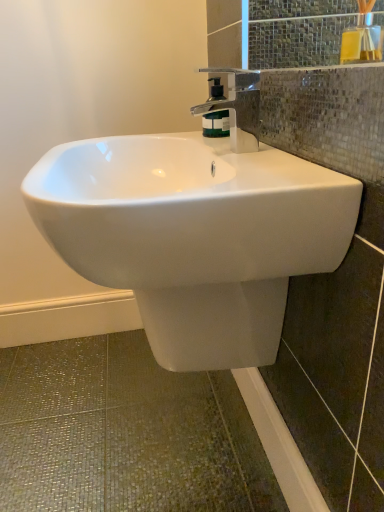
This screenshot has height=512, width=384. I want to click on polished chrome faucet at upper center, so [x=238, y=106].

The width and height of the screenshot is (384, 512). Describe the element at coordinates (216, 124) in the screenshot. I see `green matte soap dispenser at center` at that location.

The width and height of the screenshot is (384, 512). Identify the location of green matte soap dispenser at center. (216, 124).

The image size is (384, 512). Identify the location of white glossy sink at center. (194, 236).

Describe the element at coordinates (362, 39) in the screenshot. Image resolution: width=384 pixels, height=512 pixels. I see `yellow glass bottle at upper right` at that location.

Image resolution: width=384 pixels, height=512 pixels. Identify the location of polished chrome faucet at upper center. (238, 106).

Which of these two, white glossy sink at center or polished chrome faucet at upper center, is bigger?

With larger size is white glossy sink at center.

Is white glossy sink at center inside or outside of polished chrome faucet at upper center?

white glossy sink at center is located beyond the bounds of polished chrome faucet at upper center.

The width and height of the screenshot is (384, 512). What are the coordinates of `tap that appears behind the white glossy sink at center` in the screenshot? It's located at (238, 106).

Which of these two, white glossy sink at center or polished chrome faucet at upper center, is wider?

Wider between the two is white glossy sink at center.

Which object is more forward, green matte soap dispenser at center or polished chrome faucet at upper center?

polished chrome faucet at upper center is more forward.

From the image's perspective, which is above, green matte soap dispenser at center or polished chrome faucet at upper center?

green matte soap dispenser at center.

From their relative heights in the image, would you say green matte soap dispenser at center is taller or shorter than polished chrome faucet at upper center?

In the image, green matte soap dispenser at center appears to be shorter than polished chrome faucet at upper center.

Find the location of a particular element. soap dispenser behind the polished chrome faucet at upper center is located at coordinates (216, 124).

Considering the positions of point (301, 182) and point (351, 59), is point (301, 182) closer or farther from the camera than point (351, 59)?

Point (301, 182).

The width and height of the screenshot is (384, 512). Find the location of `mouthwash above the white glossy sink at center (from a real-world perspective)`. mouthwash above the white glossy sink at center (from a real-world perspective) is located at coordinates (362, 39).

Consider the image. From a real-world perspective, is white glossy sink at center physically located above or below yellow glass bottle at upper right?

white glossy sink at center is situated lower than yellow glass bottle at upper right in the real world.

Which of these two, white glossy sink at center or yellow glass bottle at upper right, is bigger?

white glossy sink at center.

You are a GUI agent. You are given a task and a screenshot of the screen. Output one action in this format:
    pyautogui.click(x=<x>, y=<y>)
    Task: Click on the soap dispenser behind the white glossy sink at center
    The width and height of the screenshot is (384, 512).
    Given the screenshot: What is the action you would take?
    pyautogui.click(x=216, y=124)

Can you confirm if green matte soap dispenser at center is bigger than white glossy sink at center?

Incorrect, green matte soap dispenser at center is not larger than white glossy sink at center.

From the image's perspective, who appears lower, green matte soap dispenser at center or white glossy sink at center?

white glossy sink at center, from the image's perspective.

How much distance is there between green matte soap dispenser at center and white glossy sink at center?

green matte soap dispenser at center and white glossy sink at center are 32.34 centimeters apart.

Is polished chrome faucet at upper center in front of white glossy sink at center?

No, it is not.

Can you tell me how much polished chrome faucet at upper center and white glossy sink at center differ in facing direction?

0.000214 degrees.

From the image's perspective, is polished chrome faucet at upper center located above white glossy sink at center?

Correct, polished chrome faucet at upper center appears higher than white glossy sink at center in the image.

Would you say white glossy sink at center is part of polished chrome faucet at upper center's contents?

No, polished chrome faucet at upper center does not contain white glossy sink at center.

Is yellow glass bottle at upper right located within polished chrome faucet at upper center?

No, yellow glass bottle at upper right is located outside of polished chrome faucet at upper center.

Is polished chrome faucet at upper center shorter than yellow glass bottle at upper right?

Indeed, polished chrome faucet at upper center has a lesser height compared to yellow glass bottle at upper right.

Measure the distance between polished chrome faucet at upper center and yellow glass bottle at upper right.

9.60 inches.

From a real-world perspective, is polished chrome faucet at upper center positioned under yellow glass bottle at upper right based on gravity?

Yes.

Looking at this image, from a real-world perspective, which object stands above the other?

yellow glass bottle at upper right.

Is green matte soap dispenser at center thinner than yellow glass bottle at upper right?

Correct, the width of green matte soap dispenser at center is less than that of yellow glass bottle at upper right.

In the image, is green matte soap dispenser at center on the left side or the right side of yellow glass bottle at upper right?

green matte soap dispenser at center is positioned on yellow glass bottle at upper right's left side.

Considering the sizes of objects green matte soap dispenser at center and yellow glass bottle at upper right in the image provided, who is taller, green matte soap dispenser at center or yellow glass bottle at upper right?

yellow glass bottle at upper right.

Locate an element on the screen. Image resolution: width=384 pixels, height=512 pixels. tap on the right of white glossy sink at center is located at coordinates (238, 106).

Locate an element on the screen. Image resolution: width=384 pixels, height=512 pixels. soap dispenser that appears below the polished chrome faucet at upper center (from a real-world perspective) is located at coordinates (216, 124).

Looking at the image, which one is located closer to green matte soap dispenser at center, white glossy sink at center or polished chrome faucet at upper center?

polished chrome faucet at upper center.

Considering their positions, is yellow glass bottle at upper right positioned further to polished chrome faucet at upper center than white glossy sink at center?

The object further to polished chrome faucet at upper center is yellow glass bottle at upper right.

Looking at the image, which one is located closer to white glossy sink at center, polished chrome faucet at upper center or green matte soap dispenser at center?

polished chrome faucet at upper center is closer to white glossy sink at center.

Based on their spatial positions, is polished chrome faucet at upper center or yellow glass bottle at upper right further from green matte soap dispenser at center?

The object further to green matte soap dispenser at center is yellow glass bottle at upper right.

Based on their spatial positions, is green matte soap dispenser at center or white glossy sink at center further from polished chrome faucet at upper center?

white glossy sink at center is positioned further to the anchor polished chrome faucet at upper center.

Which object lies nearer to the anchor point green matte soap dispenser at center, white glossy sink at center or yellow glass bottle at upper right?

yellow glass bottle at upper right lies closer to green matte soap dispenser at center than the other object.

Estimate the real-world distances between objects in this image. Which object is closer to green matte soap dispenser at center, yellow glass bottle at upper right or white glossy sink at center?

yellow glass bottle at upper right.

From the image, which object appears to be farther from white glossy sink at center, yellow glass bottle at upper right or green matte soap dispenser at center?

yellow glass bottle at upper right is positioned further to the anchor white glossy sink at center.

Locate an element on the screen. The image size is (384, 512). soap dispenser that lies between yellow glass bottle at upper right and white glossy sink at center from top to bottom is located at coordinates (216, 124).

The height and width of the screenshot is (512, 384). Identify the location of tap between green matte soap dispenser at center and yellow glass bottle at upper right in the horizontal direction. (238, 106).

The height and width of the screenshot is (512, 384). I want to click on tap that lies between yellow glass bottle at upper right and white glossy sink at center from top to bottom, so click(238, 106).

Find the location of a particular element. tap located between white glossy sink at center and green matte soap dispenser at center in the depth direction is located at coordinates (238, 106).